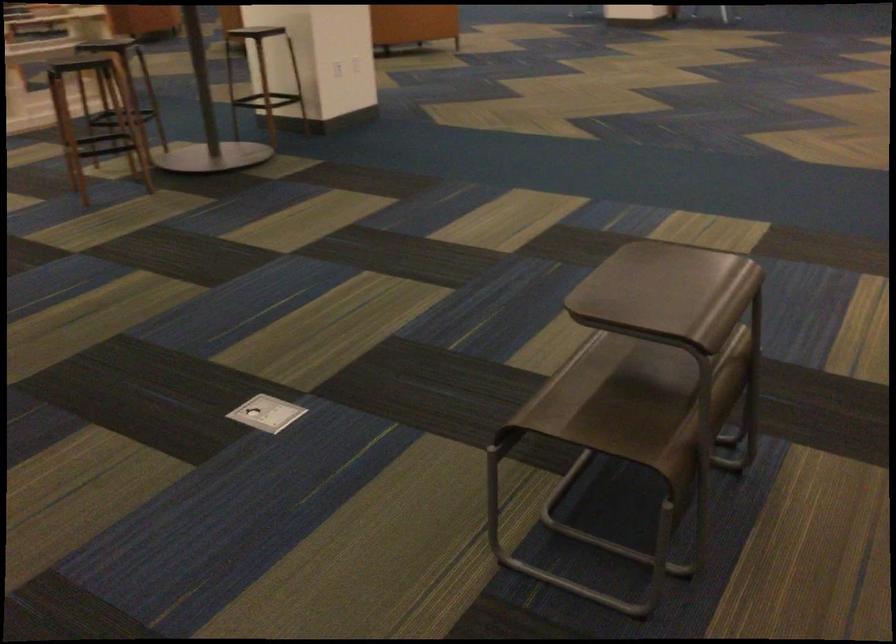
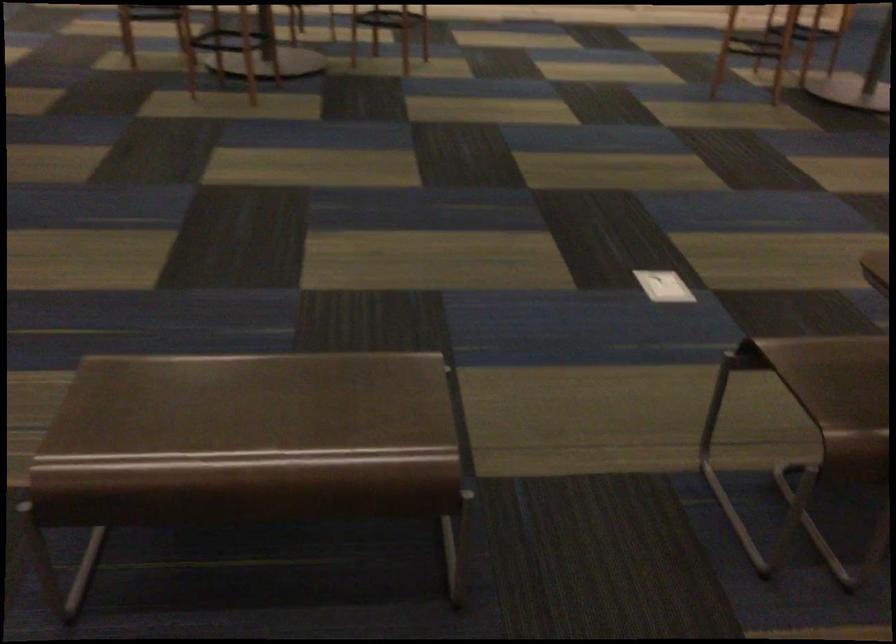
Question: How did the camera likely rotate?

Choices:
 (A) Left
 (B) Right
 (C) Up
 (D) Down

Answer: (A)